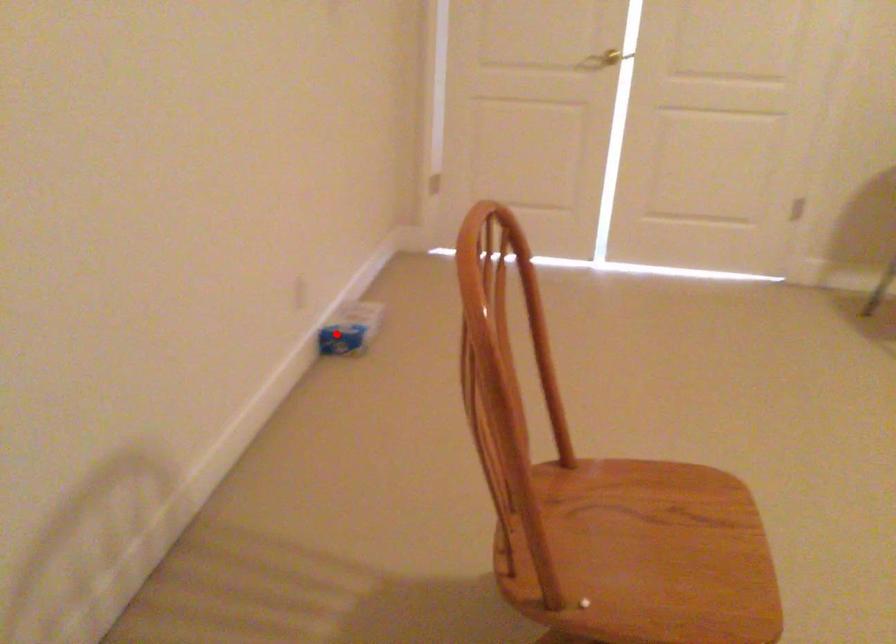
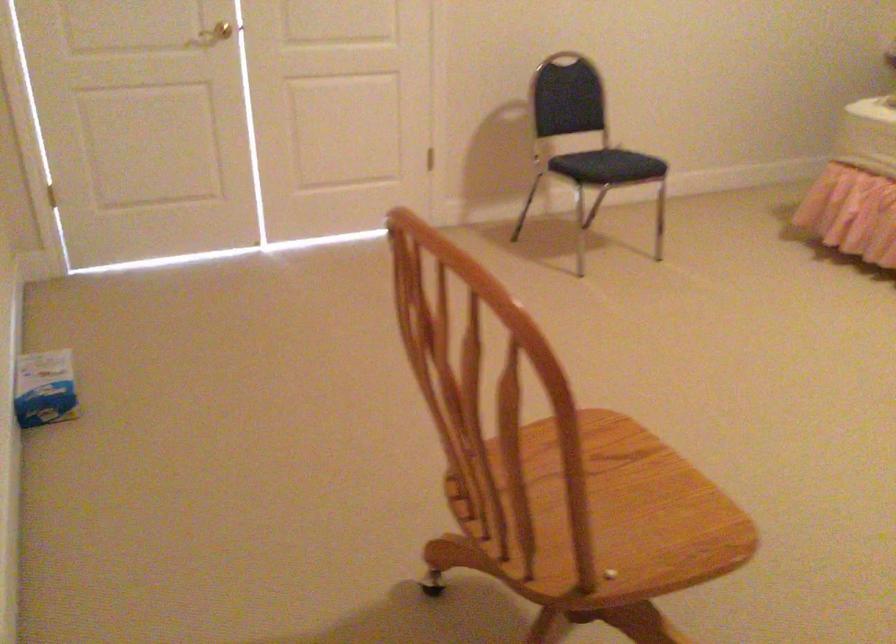
In the second image, find the point that corresponds to the highlighted location in the first image.

(45, 388)